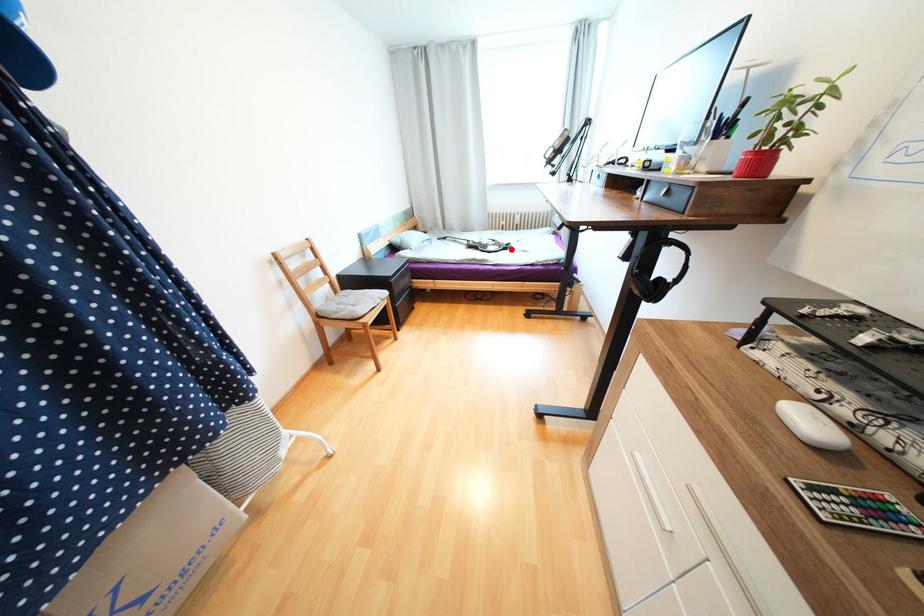
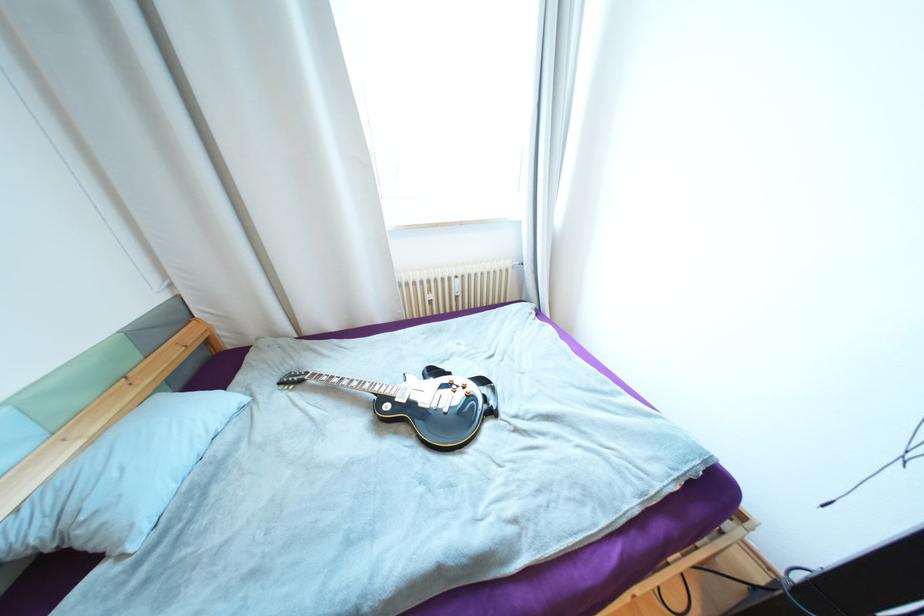
Find the pixel in the second image that matches the highlighted location in the first image.

(497, 413)